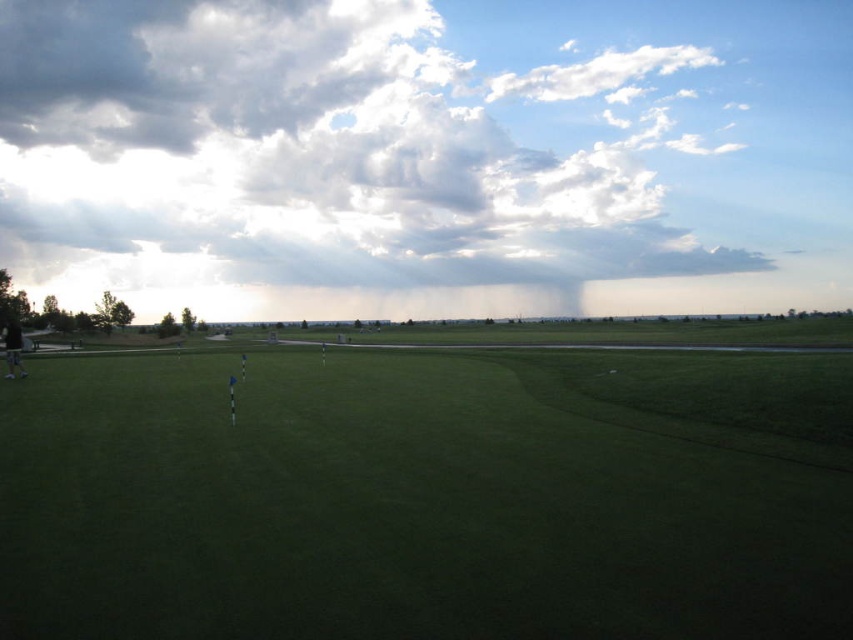
You are a golfer standing on the green grassy field at center. Looking up, you see the cloudy sky at upper center. Which object is closer to your eyes?

The green grassy field at center is closer to your eyes because it is positioned under the cloudy sky at upper center, meaning the sky is above and farther away.

You are a golfer standing on the green grassy field at center and want to hit your ball to the edge of the cloudy sky at upper center. Considering the spatial relationship between the two, which direction should you aim your shot?

The green grassy field at center is thinner than the cloudy sky at upper center, so you should aim towards the upper part of the field to reach the edge of the cloudy sky at upper center.